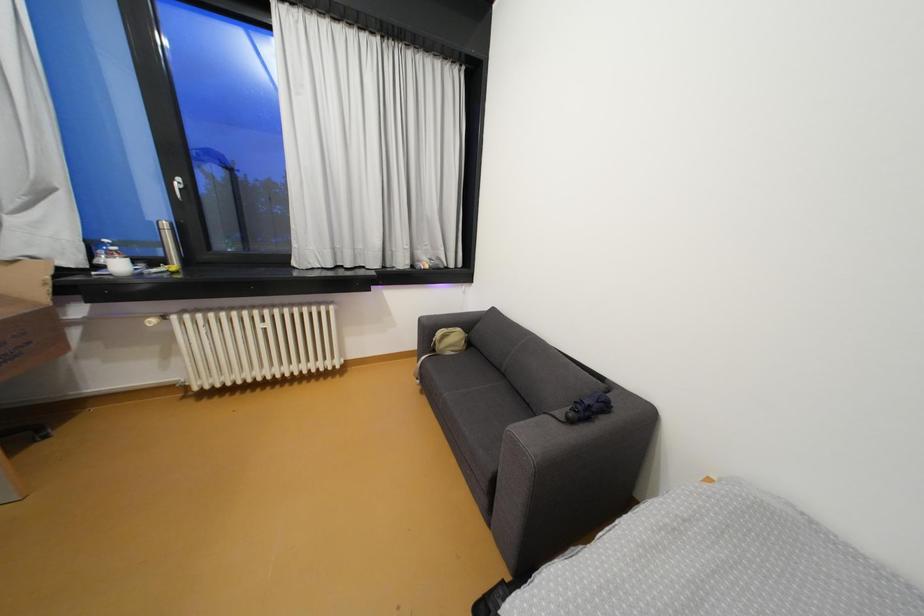
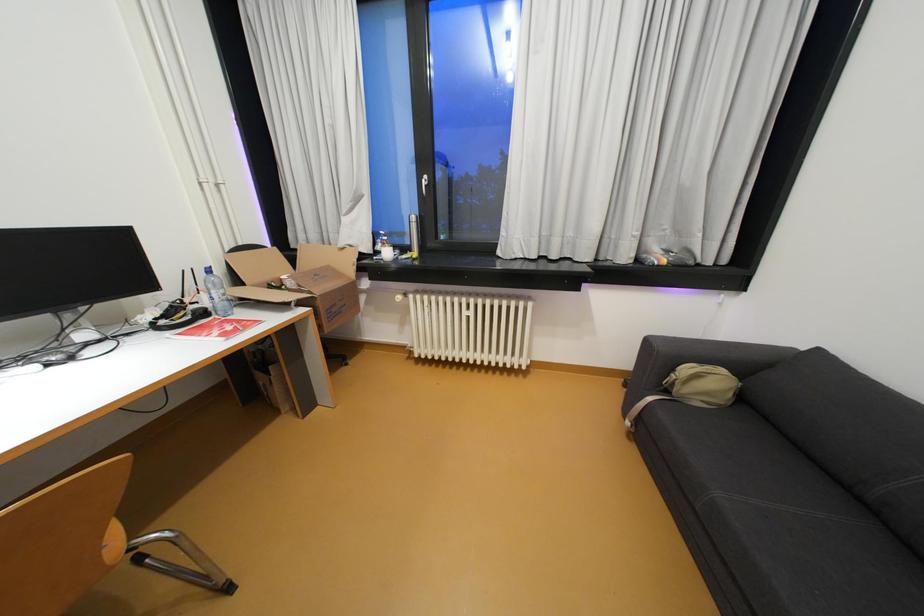
Question: How did the camera likely rotate?

Choices:
 (A) Left
 (B) Right
 (C) Up
 (D) Down

Answer: (A)